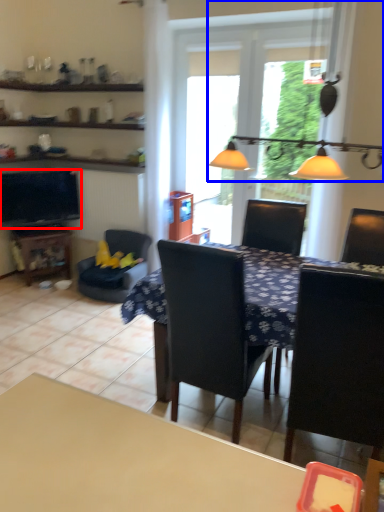
Question: Which object is closer to the camera taking this photo, television (highlighted by a red box) or light fixture (highlighted by a blue box)?

Choices:
 (A) television
 (B) light fixture

Answer: (B)